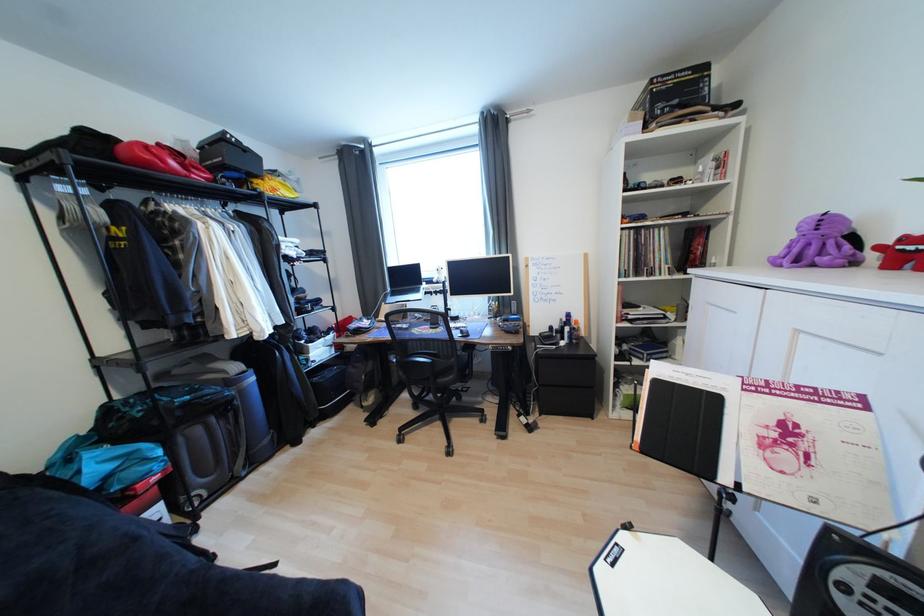
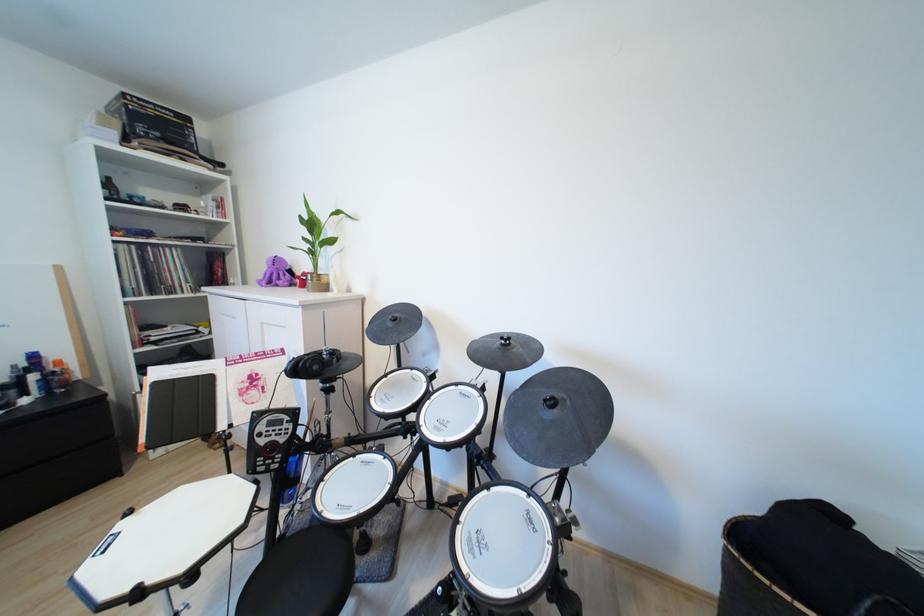
Find the pixel in the second image that matches the point at 833,248 in the first image.

(289, 277)